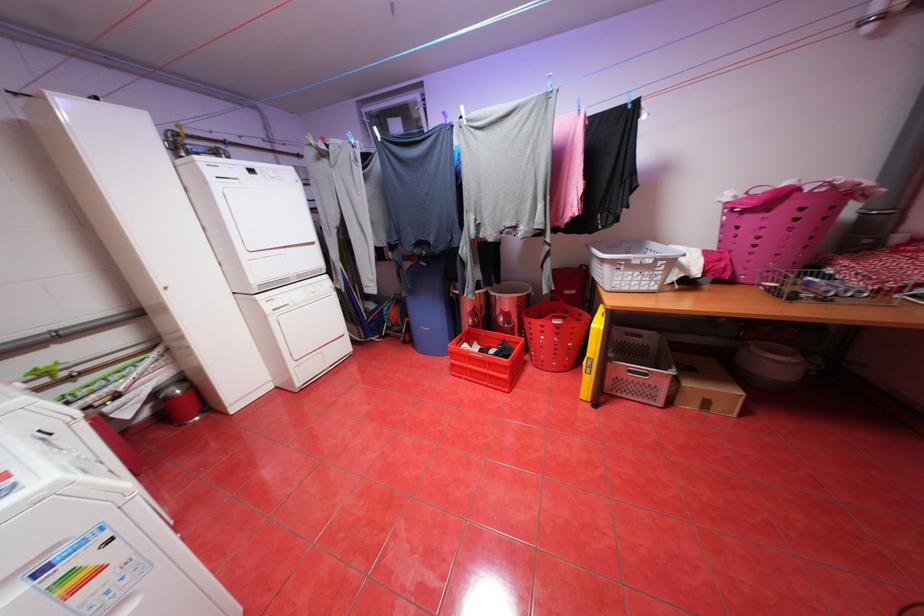
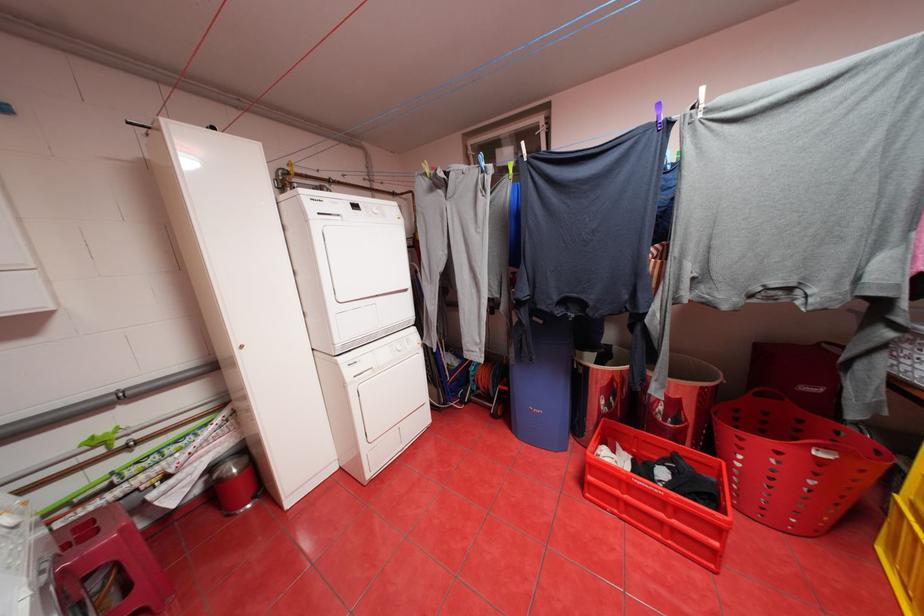
In the second image, find the point that corresponds to point 564,321 in the first image.

(828, 453)